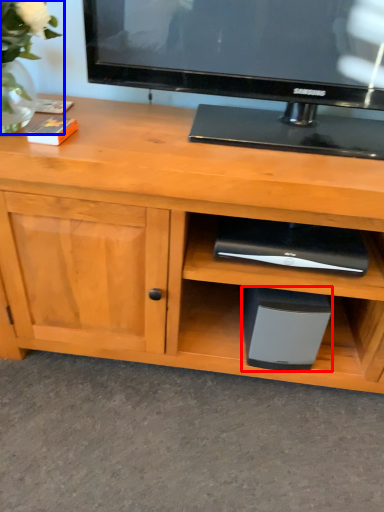
Question: Among these objects, which one is nearest to the camera, appliance (highlighted by a red box) or floral arrangement (highlighted by a blue box)?

Choices:
 (A) appliance
 (B) floral arrangement

Answer: (B)